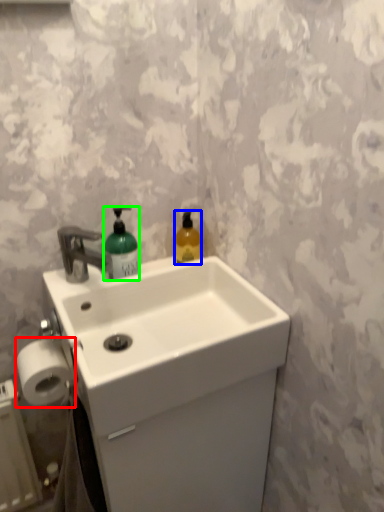
Question: Considering the real-world distances, which object is farthest from toilet paper (highlighted by a red box)? bottle (highlighted by a blue box) or bottle (highlighted by a green box)?

Choices:
 (A) bottle
 (B) bottle

Answer: (A)